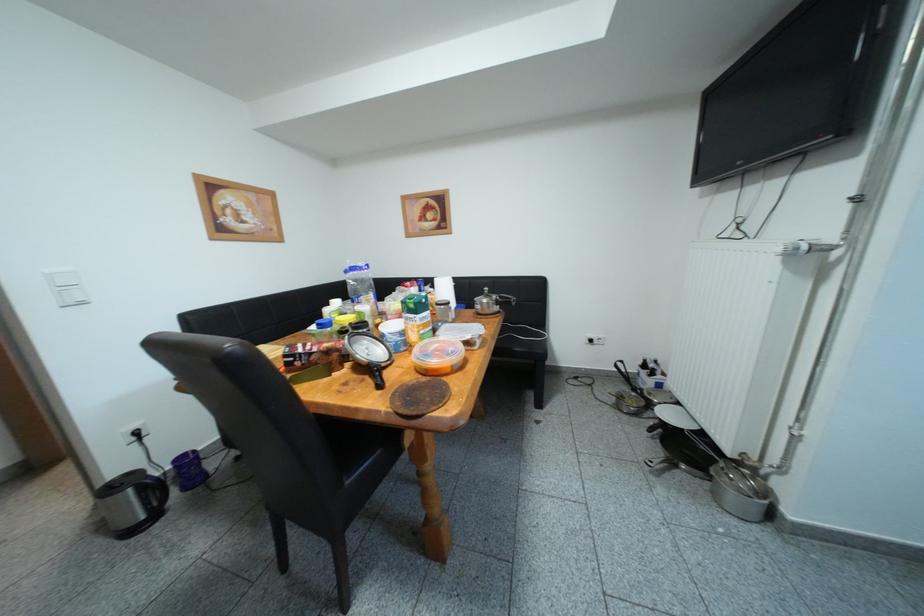
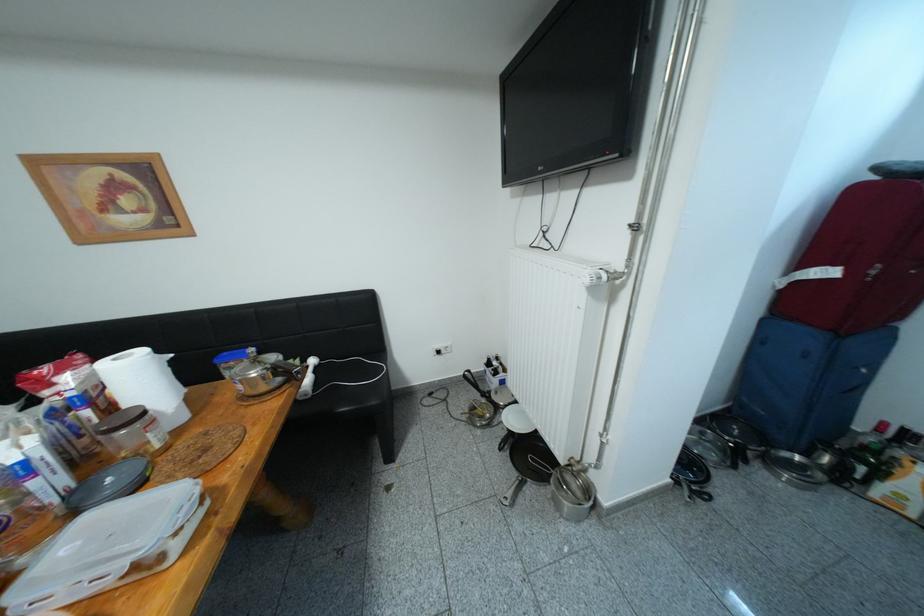
Question: The camera is either moving clockwise (left) or counter-clockwise (right) around the object. The first image is from the beginning of the video and the second image is from the end. Is the camera moving left or right when shooting the video?

Choices:
 (A) Left
 (B) Right

Answer: (A)